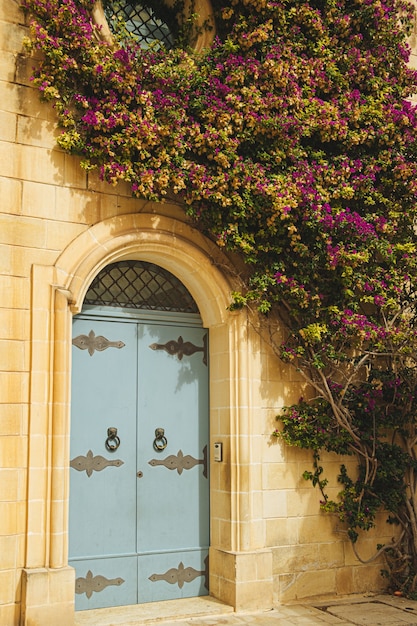
Find the location of `decorative metal`. decorative metal is located at coordinates point(183,459), point(180,347), point(92,341), point(84,463), point(93,583), point(180,570).